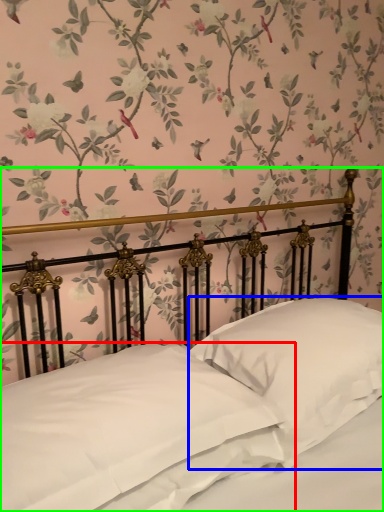
Question: Estimate the real-world distances between objects in this image. Which object is closer to pillow (highlighted by a red box), pillow (highlighted by a blue box) or bed (highlighted by a green box)?

Choices:
 (A) pillow
 (B) bed

Answer: (B)